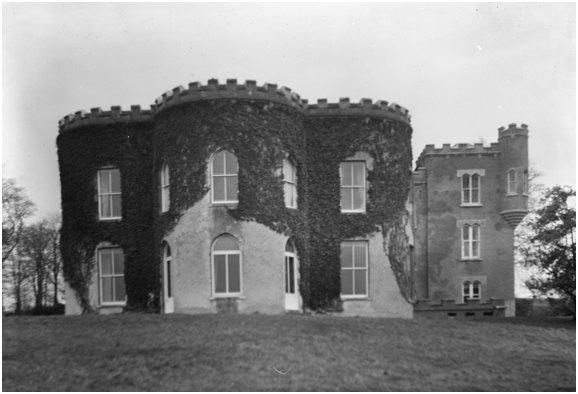
Identify the location of 2nd floor window. (111, 207), (163, 192), (224, 185), (292, 192), (351, 190), (473, 242).